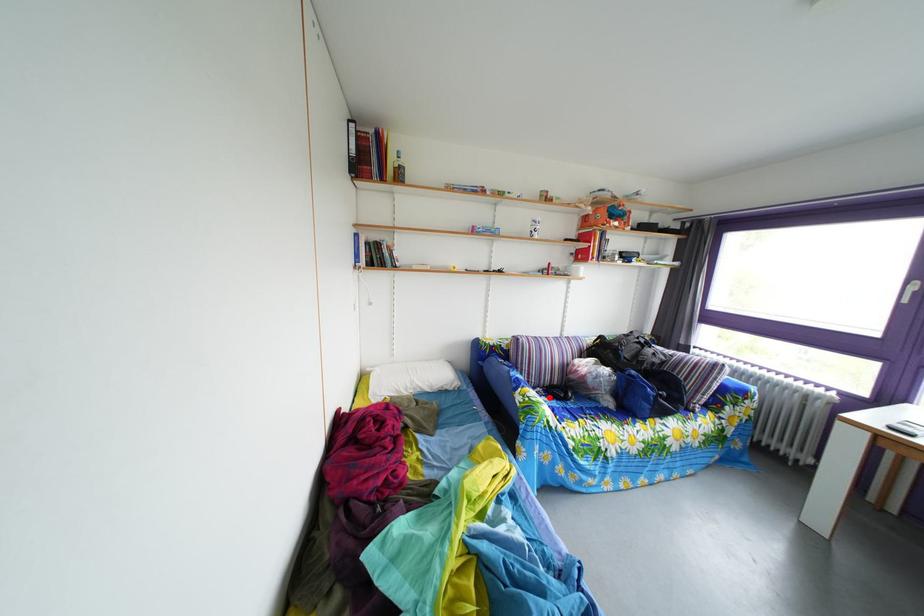
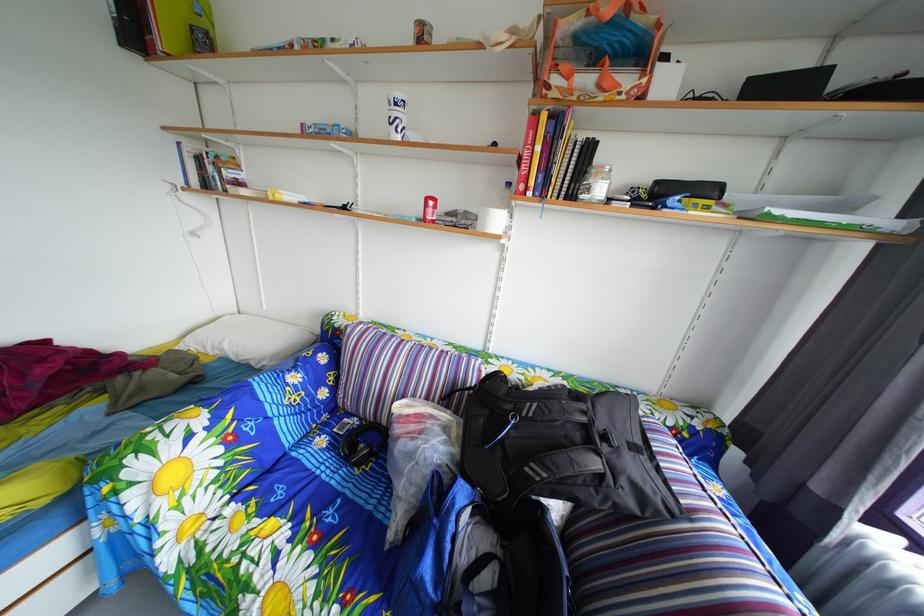
Question: I am providing you with two images of the same scene from different viewpoints. Given a red point in image1, look at the same physical point in image2. Is it:

Choices:
 (A) Closer to the viewpoint
 (B) Farther from the viewpoint

Answer: (B)